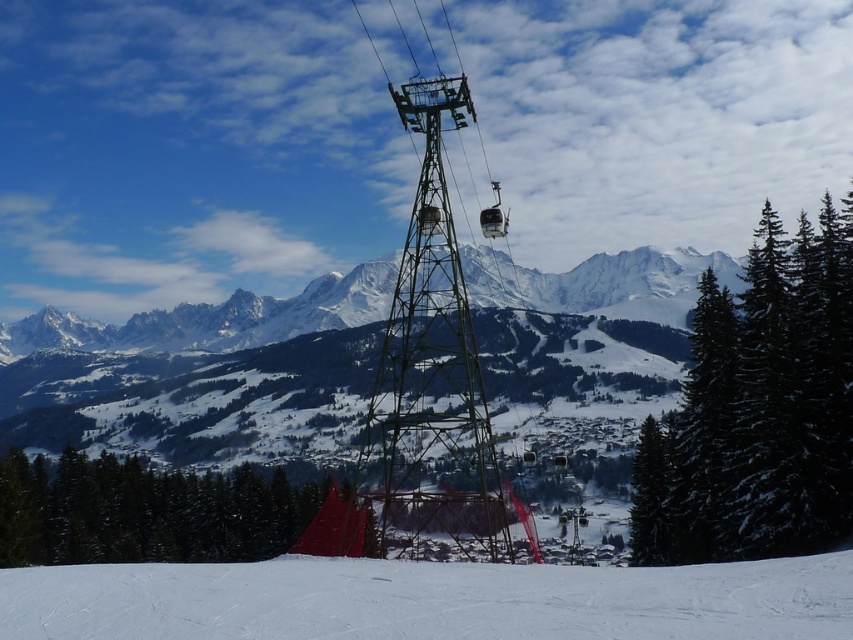
From the picture: Is white snow at center smaller than green textured pine trees at right?

Indeed, white snow at center has a smaller size compared to green textured pine trees at right.

Is point (62, 602) positioned after point (825, 307)?

No, it is not.

Which is behind, point (401, 611) or point (769, 304)?

Positioned behind is point (769, 304).

This screenshot has height=640, width=853. Find the location of `white snow at center`. white snow at center is located at coordinates (428, 600).

Who is taller, green textured pine trees at right or green metallic tower at center?

green metallic tower at center is taller.

Which is in front, point (816, 406) or point (444, 500)?

Point (816, 406) is more forward.

Where is `green textured pine trees at right`? The height and width of the screenshot is (640, 853). green textured pine trees at right is located at coordinates (758, 410).

Is green metallic tower at center shorter than green matte tent at lower left?

No, green metallic tower at center is not shorter than green matte tent at lower left.

From the picture: Can you confirm if green metallic tower at center is wider than green matte tent at lower left?

No.

At what (x,y) coordinates should I click in order to perform the action: click on green metallic tower at center. Please return your answer as a coordinate pair (x, y). The height and width of the screenshot is (640, 853). Looking at the image, I should click on (431, 376).